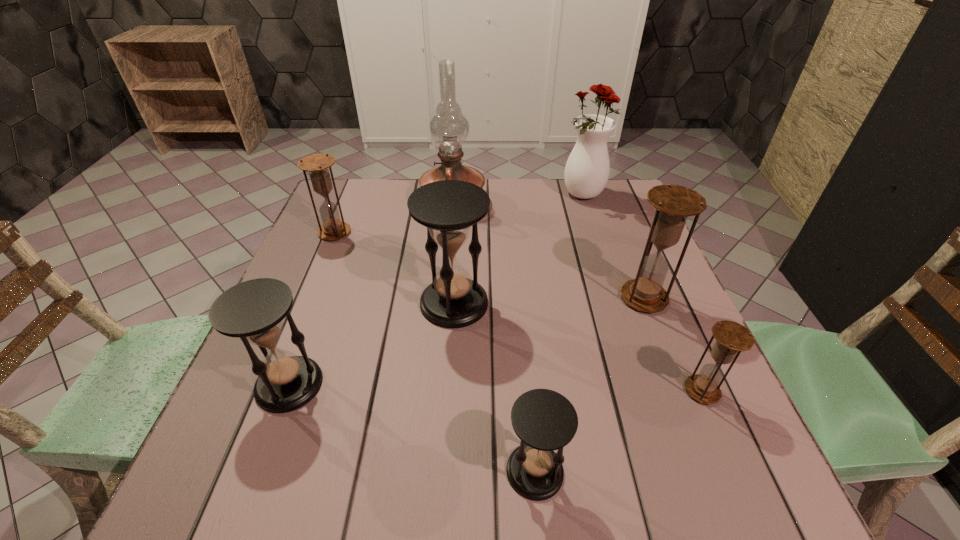
At what (x,y) coordinates should I click in order to perform the action: click on free space that satisfies the following two spatial constraints: 1. on the back side of the seventh shortest object; 2. on the left side of the fifth object from left to right. Please return your answer as a coordinate pair (x, y). Looking at the image, I should click on (510, 195).

Find the location of a particular element. vacant space that satisfies the following two spatial constraints: 1. on the back side of the second farthest brown hourglass; 2. on the left side of the biggest black hourglass is located at coordinates (454, 298).